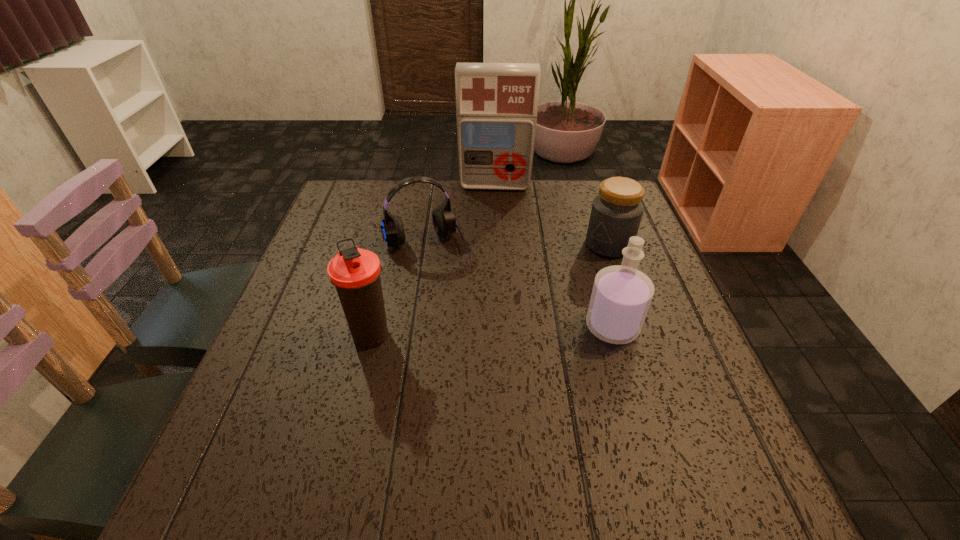
The height and width of the screenshot is (540, 960). I want to click on vacant space located 0.320m on the ear cushions of the headset, so click(480, 364).

At what (x,y) coordinates should I click in order to perform the action: click on vacant space located on the surface of the jar near the warning symbol. Please return your answer as a coordinate pair (x, y). The width and height of the screenshot is (960, 540). Looking at the image, I should click on (534, 293).

Identify the location of free space located 0.400m on the surface of the jar near the warning symbol. (474, 331).

Find the location of a particular element. The image size is (960, 540). blank space located on the surface of the jar near the warning symbol is located at coordinates (x=512, y=307).

In order to click on vacant region located 0.100m on the front-facing side of the farthest object in this screenshot , I will do `click(493, 211)`.

This screenshot has width=960, height=540. I want to click on vacant space located 0.400m on the front-facing side of the farthest object, so click(491, 280).

Identify the location of vacant space located on the front-facing side of the farthest object. The image size is (960, 540). (492, 235).

At what (x,y) coordinates should I click in order to perform the action: click on object positioned at the far edge. Please return your answer as a coordinate pair (x, y). Looking at the image, I should click on (496, 103).

The width and height of the screenshot is (960, 540). In order to click on perfume located in the right edge section of the desktop in this screenshot , I will do point(621,295).

I want to click on jar present at the right edge, so click(617, 210).